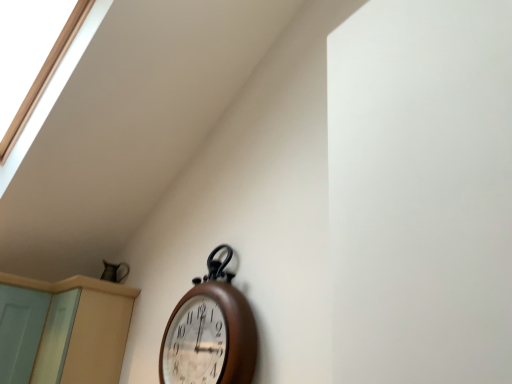
Question: Can you confirm if light blue wood screen door at lower left is thinner than wooden wall clock at center?

Choices:
 (A) no
 (B) yes

Answer: (A)

Question: Is light blue wood screen door at lower left bigger than wooden wall clock at center?

Choices:
 (A) no
 (B) yes

Answer: (B)

Question: Are light blue wood screen door at lower left and wooden wall clock at center far apart?

Choices:
 (A) no
 (B) yes

Answer: (B)

Question: Would you say light blue wood screen door at lower left is outside wooden wall clock at center?

Choices:
 (A) yes
 (B) no

Answer: (A)

Question: Can you confirm if light blue wood screen door at lower left is wider than wooden wall clock at center?

Choices:
 (A) no
 (B) yes

Answer: (B)

Question: From a real-world perspective, is light blue wood screen door at lower left physically located above or below wooden wall clock at center?

Choices:
 (A) above
 (B) below

Answer: (B)

Question: Is light blue wood screen door at lower left taller or shorter than wooden wall clock at center?

Choices:
 (A) tall
 (B) short

Answer: (B)

Question: From the image's perspective, is light blue wood screen door at lower left located above or below wooden wall clock at center?

Choices:
 (A) below
 (B) above

Answer: (A)

Question: Is light blue wood screen door at lower left to the left or to the right of wooden wall clock at center in the image?

Choices:
 (A) left
 (B) right

Answer: (A)

Question: Is wooden wall clock at center spatially inside beige wood dresser at lower left, or outside of it?

Choices:
 (A) outside
 (B) inside

Answer: (A)

Question: Is wooden wall clock at center taller or shorter than beige wood dresser at lower left?

Choices:
 (A) short
 (B) tall

Answer: (B)

Question: Visually, is wooden wall clock at center positioned to the left or to the right of beige wood dresser at lower left?

Choices:
 (A) left
 (B) right

Answer: (B)

Question: Is wooden wall clock at center wider or thinner than beige wood dresser at lower left?

Choices:
 (A) thin
 (B) wide

Answer: (A)

Question: Considering their positions, is light blue wood screen door at lower left located in front of or behind beige wood dresser at lower left?

Choices:
 (A) behind
 (B) front

Answer: (A)

Question: Looking at the image, does light blue wood screen door at lower left seem bigger or smaller compared to beige wood dresser at lower left?

Choices:
 (A) big
 (B) small

Answer: (B)